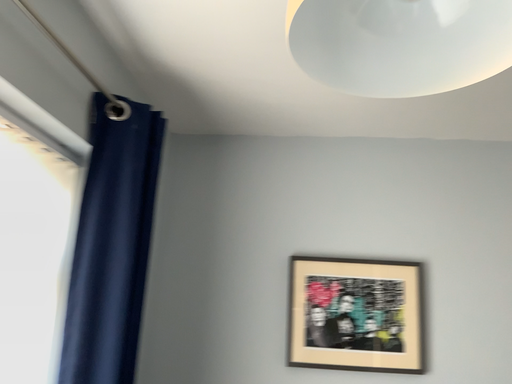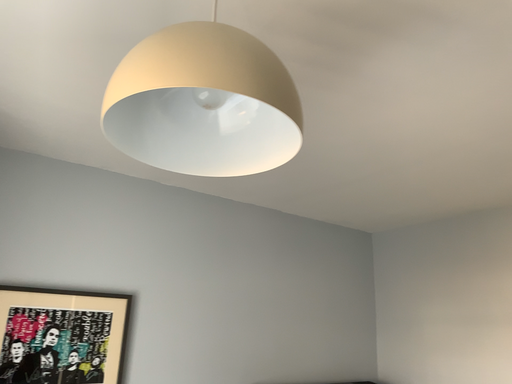
Question: How did the camera likely rotate when shooting the video?

Choices:
 (A) rotated right
 (B) rotated left

Answer: (A)